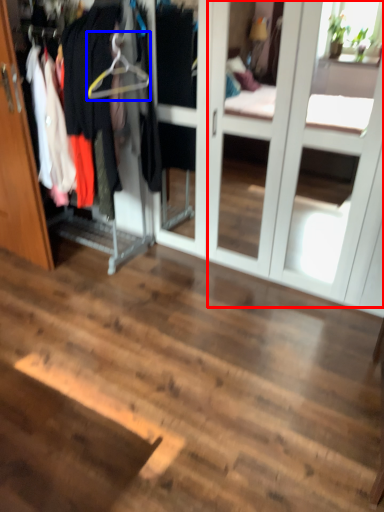
Question: Which point is closer to the camera, screen door (highlighted by a red box) or hanger (highlighted by a blue box)?

Choices:
 (A) screen door
 (B) hanger

Answer: (A)